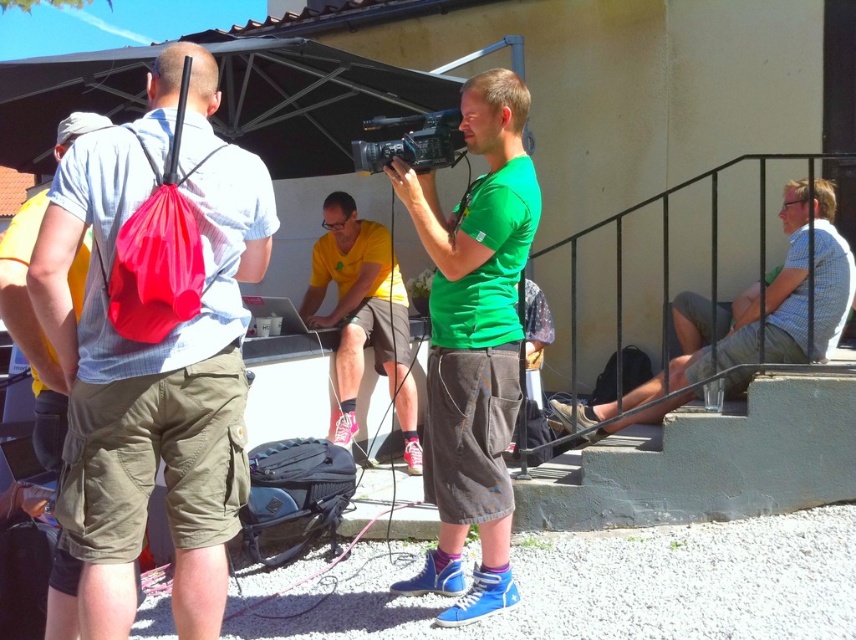
Question: Estimate the real-world distances between objects in this image. Which object is closer to the green matte shirt at center?

Choices:
 (A) white checkered shirt at right
 (B) matte nylon backpack at left
 (C) yellow fabric shirt at center

Answer: (B)

Question: Which of the following is the closest to the observer?

Choices:
 (A) green matte shirt at center
 (B) yellow fabric shirt at center
 (C) matte nylon backpack at left
 (D) black plastic video camera at center

Answer: (C)

Question: Is white checkered shirt at right below yellow fabric shirt at center?

Choices:
 (A) yes
 (B) no

Answer: (A)

Question: Does white checkered shirt at right have a lesser width compared to yellow fabric shirt at center?

Choices:
 (A) no
 (B) yes

Answer: (A)

Question: Is matte nylon backpack at left above white checkered shirt at right?

Choices:
 (A) no
 (B) yes

Answer: (B)

Question: Among these objects, which one is nearest to the camera?

Choices:
 (A) green matte shirt at center
 (B) yellow fabric shirt at center
 (C) black plastic video camera at center

Answer: (A)